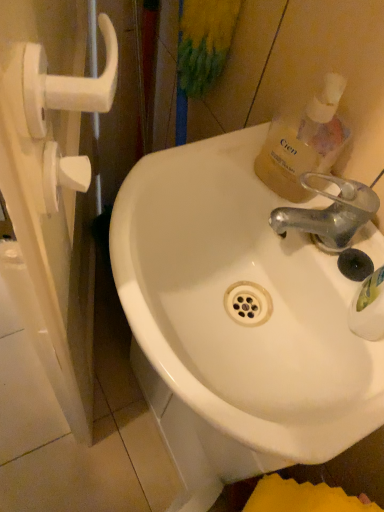
Measure the distance between point (274, 226) and camera.

They are 20.47 inches apart.

Describe the element at coordinates (52, 213) in the screenshot. I see `white plastic handle at left` at that location.

The height and width of the screenshot is (512, 384). I want to click on metallic silver faucet at upper right, so coord(330,213).

Which object is thinner, white plastic handle at left or white glossy sink at center?

white plastic handle at left is thinner.

Is white plastic handle at left in front of or behind white glossy sink at center in the image?

white plastic handle at left is in front of white glossy sink at center.

Can you tell me how much white plastic handle at left and white glossy sink at center differ in facing direction?

There is a 21-degree angle between the facing directions of white plastic handle at left and white glossy sink at center.

Which is in front, point (270, 127) or point (183, 332)?

Point (183, 332)

Is translucent plastic bottle at upper right to the right of white glossy sink at center from the viewer's perspective?

Yes.

You are a GUI agent. You are given a task and a screenshot of the screen. Output one action in this format:
    pyautogui.click(x=<x>, y=<y>)
    Task: Click on the screen door below the white glossy sink at center (from a real-world perspective)
    
    Given the screenshot: What is the action you would take?
    tap(52, 213)

Which of these two, white glossy sink at center or white plastic handle at left, is smaller?

white glossy sink at center is smaller.

From the image's perspective, is white glossy sink at center on top of white plastic handle at left?

No.

Is white glossy sink at center facing away from white plastic handle at left?

No.

From a real-world perspective, does translucent plastic bottle at upper right stand above white plastic handle at left?

Indeed, from a real-world perspective, translucent plastic bottle at upper right stands above white plastic handle at left.

Which object is thinner, translucent plastic bottle at upper right or white plastic handle at left?

translucent plastic bottle at upper right is thinner.

Consider the image. Which object is positioned more to the right, translucent plastic bottle at upper right or white plastic handle at left?

translucent plastic bottle at upper right.

How distant is white glossy sink at center from metallic silver faucet at upper right?

white glossy sink at center is 6.09 inches from metallic silver faucet at upper right.

Which object is thinner, white glossy sink at center or metallic silver faucet at upper right?

metallic silver faucet at upper right.

Does white glossy sink at center appear on the left side of metallic silver faucet at upper right?

Correct, you'll find white glossy sink at center to the left of metallic silver faucet at upper right.

From the image's perspective, which is above, white glossy sink at center or metallic silver faucet at upper right?

metallic silver faucet at upper right.

What are the coordinates of `tap behind the white plastic handle at left` in the screenshot? It's located at (330, 213).

Between metallic silver faucet at upper right and white plastic handle at left, which one is positioned behind?

metallic silver faucet at upper right is further away from the camera.

Is metallic silver faucet at upper right with white plastic handle at left?

No, metallic silver faucet at upper right is not in contact with white plastic handle at left.

Which is closer, [336,198] or [73,122]?

Point [336,198] is closer to the camera than point [73,122].

Who is taller, white plastic handle at left or translucent plastic bottle at upper right?

white plastic handle at left.

Considering the relative positions of white plastic handle at left and translucent plastic bottle at upper right in the image provided, is white plastic handle at left to the left or to the right of translucent plastic bottle at upper right?

From the image, it's evident that white plastic handle at left is to the left of translucent plastic bottle at upper right.

Is point (101, 24) more distant than point (318, 154)?

That is True.

Identify the location of sink behind the white plastic handle at left. (236, 321).

The height and width of the screenshot is (512, 384). Find the location of `bottle located above the white glossy sink at center (from a real-world perspective)`. bottle located above the white glossy sink at center (from a real-world perspective) is located at coordinates (304, 142).

Which object lies further to the anchor point white glossy sink at center, white plastic handle at left or translucent plastic bottle at upper right?

The object further to white glossy sink at center is white plastic handle at left.

Estimate the real-world distances between objects in this image. Which object is closer to translucent plastic bottle at upper right, white glossy sink at center or metallic silver faucet at upper right?

metallic silver faucet at upper right.

From the image, which object appears to be nearer to translucent plastic bottle at upper right, white plastic handle at left or metallic silver faucet at upper right?

metallic silver faucet at upper right.

When comparing their distances from white glossy sink at center, does white plastic handle at left or metallic silver faucet at upper right seem further?

Based on the image, white plastic handle at left appears to be further to white glossy sink at center.

Estimate the real-world distances between objects in this image. Which object is closer to metallic silver faucet at upper right, white glossy sink at center or white plastic handle at left?

Among the two, white glossy sink at center is located nearer to metallic silver faucet at upper right.

Consider the image. Which object lies nearer to the anchor point metallic silver faucet at upper right, white plastic handle at left or white glossy sink at center?

white glossy sink at center is closer to metallic silver faucet at upper right.

Based on their spatial positions, is translucent plastic bottle at upper right or white plastic handle at left further from metallic silver faucet at upper right?

white plastic handle at left lies further to metallic silver faucet at upper right than the other object.

Based on their spatial positions, is white plastic handle at left or translucent plastic bottle at upper right further from metallic silver faucet at upper right?

Among the two, white plastic handle at left is located further to metallic silver faucet at upper right.

You are a GUI agent. You are given a task and a screenshot of the screen. Output one action in this format:
    pyautogui.click(x=<x>, y=<y>)
    Task: Click on the sink between white plastic handle at left and translucent plastic bottle at upper right
    This screenshot has height=512, width=384.
    Given the screenshot: What is the action you would take?
    pyautogui.click(x=236, y=321)

In order to click on bottle between white plastic handle at left and metallic silver faucet at upper right from left to right in this screenshot , I will do `click(304, 142)`.

Identify the location of sink between white plastic handle at left and metallic silver faucet at upper right from left to right. The width and height of the screenshot is (384, 512). coord(236,321).

I want to click on tap between translucent plastic bottle at upper right and white glossy sink at center in the vertical direction, so click(x=330, y=213).